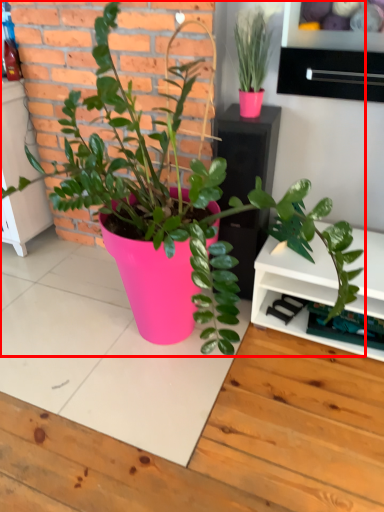
Question: From the image's perspective, what is the correct spatial positioning of houseplant (annotated by the red box) in reference to drawer?

Choices:
 (A) below
 (B) above

Answer: (A)